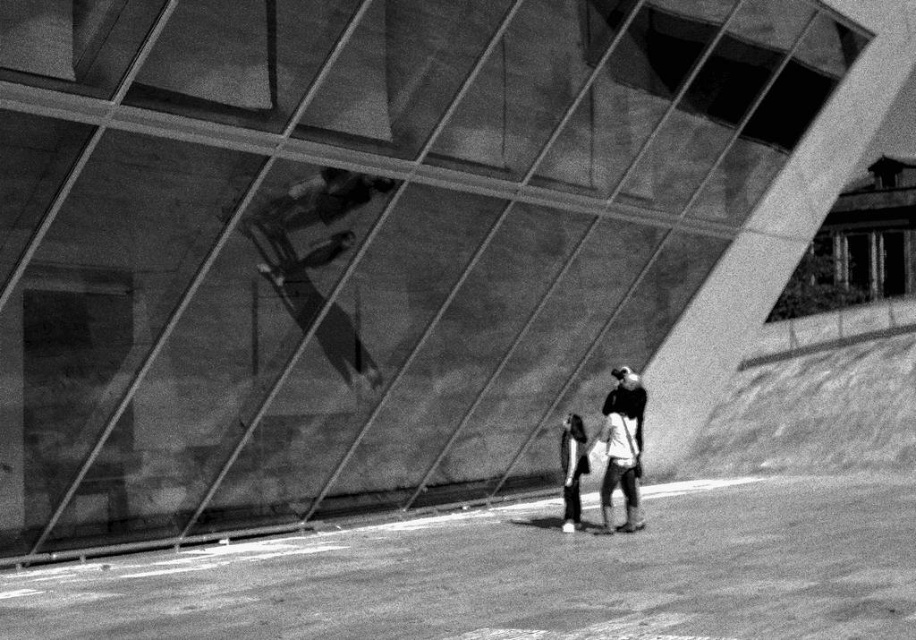
Looking at this image, you are standing in front of the modern architectural structure and see two points marked on the ground near the base of the building. The points are labeled as point 1 at coordinates (630, 500) and point 2 at coordinates (570, 451). Which point is closer to you?

Point 1 at coordinates (630, 500) is closer to you than point 2 at coordinates (570, 451).

You are standing in front of the modern building and see the white cotton shirt at center and the dark gray fabric jacket at lower center. Which clothing item is positioned more to the right side of the frame?

The white cotton shirt at center is to the right of the dark gray fabric jacket at lower center, so the white cotton shirt at center is positioned more to the right side of the frame.

You are a photographer trying to capture a clear shot of the white cotton shirt at center and the dark gray fabric jacket at lower center. Based on their positions, which one is closer to the camera?

The white cotton shirt at center is in front of the dark gray fabric jacket at lower center, so it is closer to the camera.